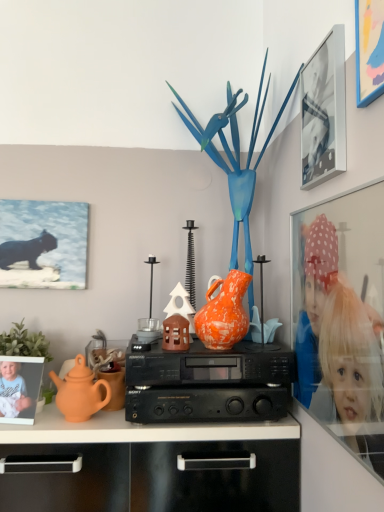
Question: Does orange speckled vase at center have a smaller size compared to metallic silver picture frame at upper right, which is counted as the third picture frame, starting from the right?

Choices:
 (A) no
 (B) yes

Answer: (A)

Question: Is orange speckled vase at center with metallic silver picture frame at upper right, which is counted as the second picture frame, starting from the back?

Choices:
 (A) yes
 (B) no

Answer: (B)

Question: Is orange speckled vase at center further to the viewer compared to metallic silver picture frame at upper right, which is counted as the second picture frame, starting from the back?

Choices:
 (A) no
 (B) yes

Answer: (B)

Question: Considering the relative positions of orange speckled vase at center and metallic silver picture frame at upper right, which ranks as the third picture frame in front-to-back order, in the image provided, is orange speckled vase at center to the right of metallic silver picture frame at upper right, which ranks as the third picture frame in front-to-back order, from the viewer's perspective?

Choices:
 (A) yes
 (B) no

Answer: (B)

Question: Is orange speckled vase at center positioned with its back to metallic silver picture frame at upper right, marked as the second picture frame in a left-to-right arrangement?

Choices:
 (A) no
 (B) yes

Answer: (A)

Question: Considering the positions of black plastic stereo at center and matte orange teapot at left in the image, is black plastic stereo at center taller or shorter than matte orange teapot at left?

Choices:
 (A) short
 (B) tall

Answer: (B)

Question: From the image's perspective, is black plastic stereo at center above or below matte orange teapot at left?

Choices:
 (A) above
 (B) below

Answer: (A)

Question: Looking at their shapes, would you say black plastic stereo at center is wider or thinner than matte orange teapot at left?

Choices:
 (A) wide
 (B) thin

Answer: (A)

Question: Is black plastic stereo at center in front of or behind matte orange teapot at left in the image?

Choices:
 (A) front
 (B) behind

Answer: (A)

Question: Is black plastic stereo at center wider or thinner than matte black cat at upper left, acting as the 1th picture frame starting from the left?

Choices:
 (A) thin
 (B) wide

Answer: (B)

Question: Is black plastic stereo at center to the left or to the right of matte black cat at upper left, acting as the 1th picture frame starting from the left, in the image?

Choices:
 (A) left
 (B) right

Answer: (B)

Question: Considering the positions of point (134, 355) and point (28, 257), is point (134, 355) closer or farther from the camera than point (28, 257)?

Choices:
 (A) closer
 (B) farther

Answer: (A)

Question: From the image's perspective, is black plastic stereo at center positioned above or below matte black cat at upper left, the fourth picture frame viewed from the front?

Choices:
 (A) above
 (B) below

Answer: (B)

Question: From their relative heights in the image, would you say blue glossy bird at center is taller or shorter than green matte plant at left?

Choices:
 (A) short
 (B) tall

Answer: (B)

Question: From a real-world perspective, relative to green matte plant at left, is blue glossy bird at center vertically above or below?

Choices:
 (A) below
 (B) above

Answer: (B)